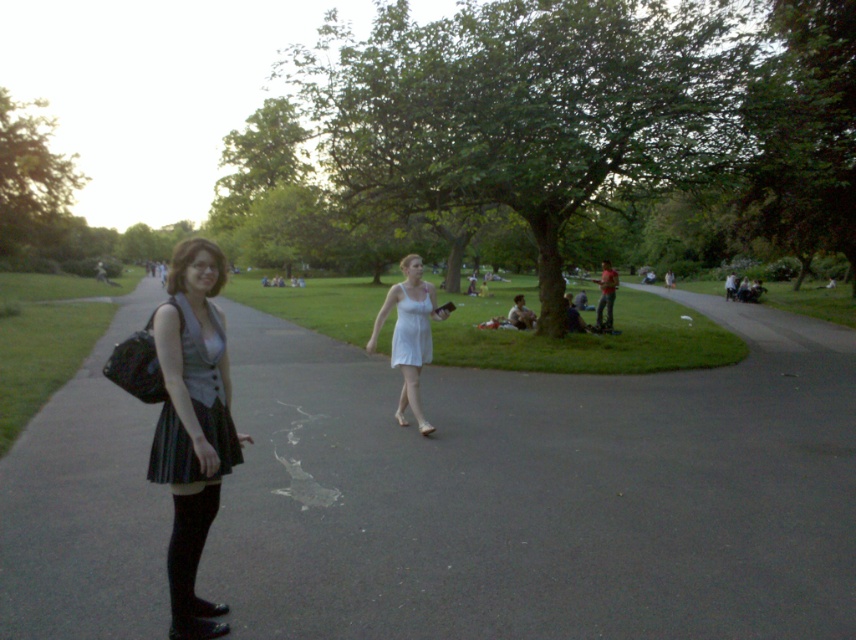
Question: Which point is farther to the camera?

Choices:
 (A) (605, 324)
 (B) (233, 440)
 (C) (779, 484)
 (D) (400, 298)

Answer: (A)

Question: Considering the real-world distances, which object is farthest from the plaid skirt at left?

Choices:
 (A) matte black skirt at left
 (B) green fabric jacket at center
 (C) smooth asphalt path at right
 (D) white matte dress at center

Answer: (C)

Question: Is plaid skirt at left smaller than green fabric jacket at center?

Choices:
 (A) yes
 (B) no

Answer: (A)

Question: Does black asphalt pavement at lower left have a greater width compared to white matte dress at center?

Choices:
 (A) no
 (B) yes

Answer: (B)

Question: Among these objects, which one is nearest to the camera?

Choices:
 (A) smooth asphalt path at right
 (B) plaid skirt at left
 (C) matte black skirt at left
 (D) white satin dress at center

Answer: (C)

Question: Does white matte dress at center appear on the right side of white satin dress at center?

Choices:
 (A) yes
 (B) no

Answer: (B)